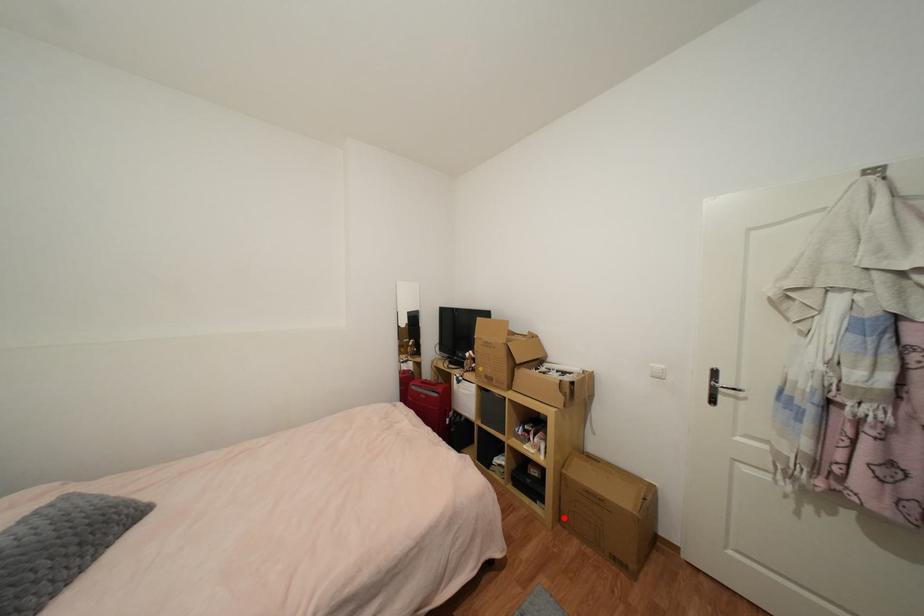
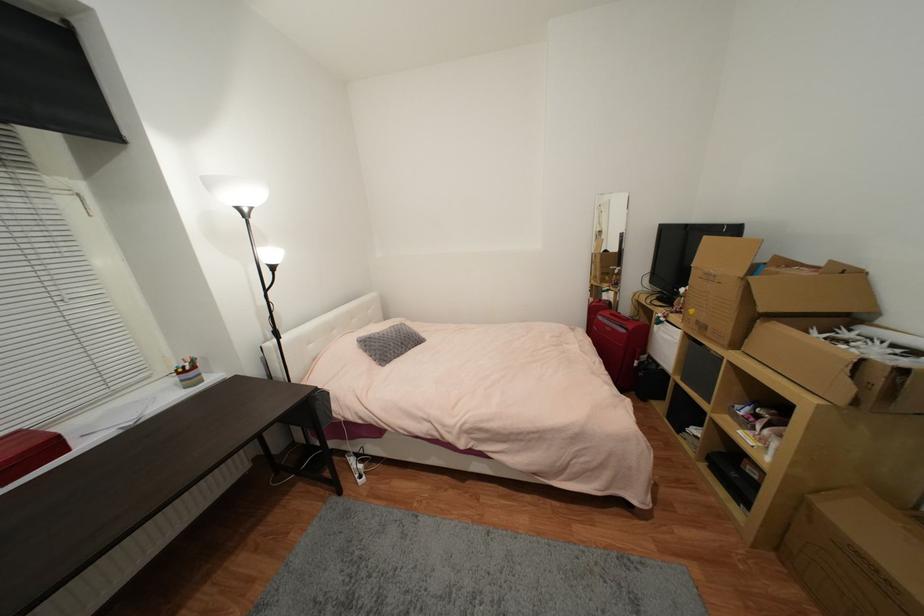
Question: I am providing you with two images of the same scene from different viewpoints. A red point is shown in image1. For the corresponding object point in image2, is it positioned nearer or farther from the camera?

Choices:
 (A) Nearer
 (B) Farther

Answer: (B)